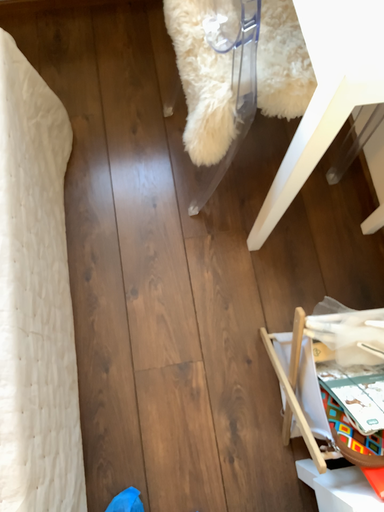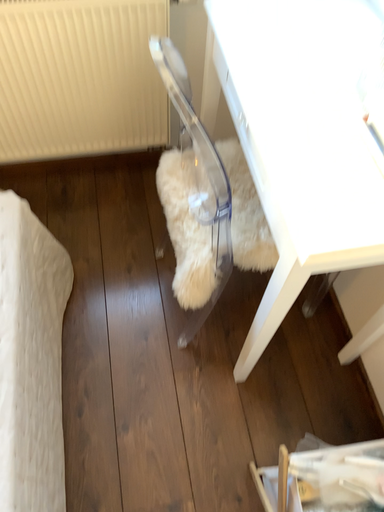
Question: How did the camera likely rotate when shooting the video?

Choices:
 (A) rotated upward
 (B) rotated downward

Answer: (A)